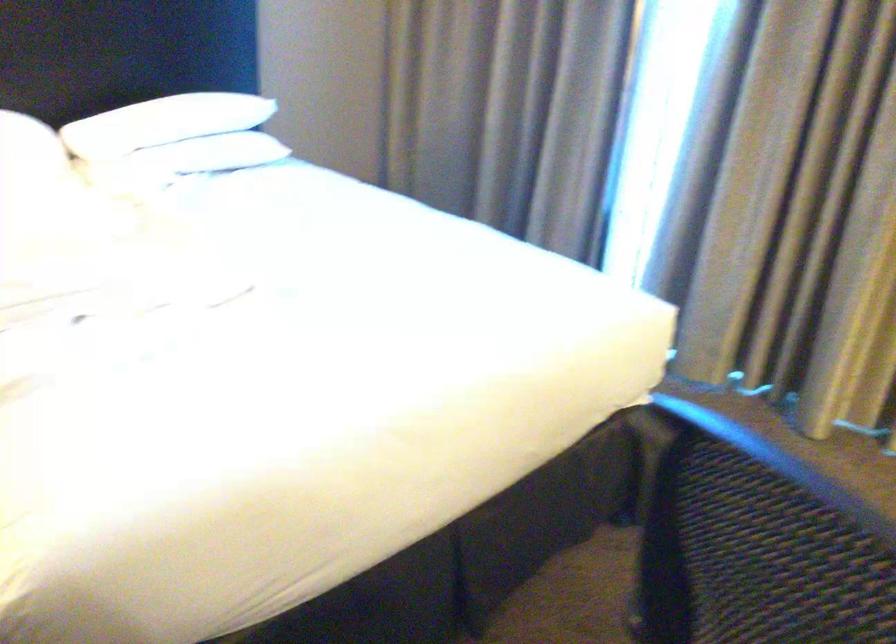
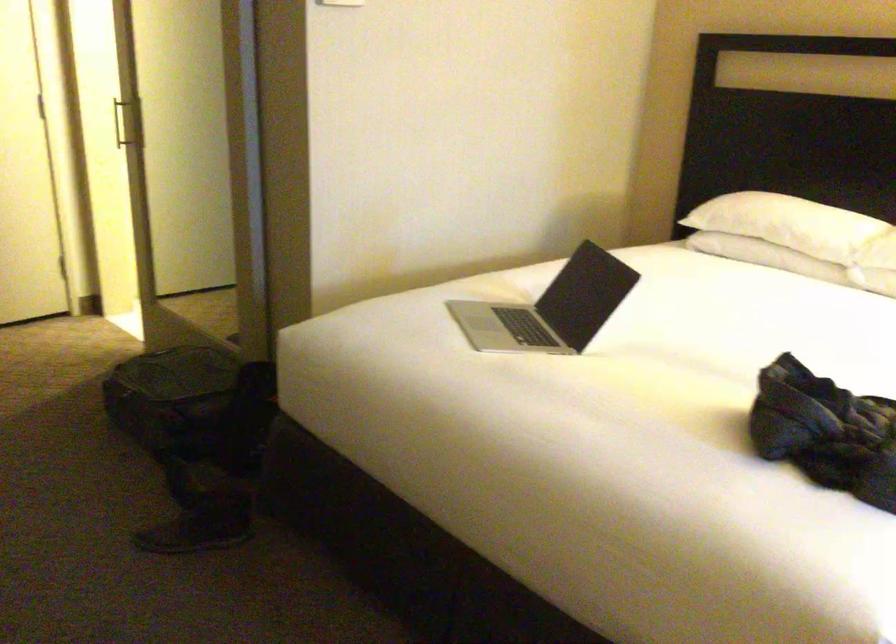
Question: The camera is either moving clockwise (left) or counter-clockwise (right) around the object. The first image is from the beginning of the video and the second image is from the end. Is the camera moving left or right when shooting the video?

Choices:
 (A) Left
 (B) Right

Answer: (B)